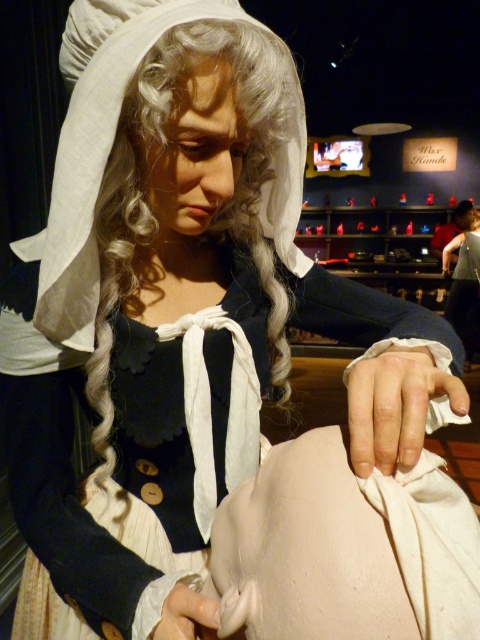
Question: Can you confirm if white silky hair at center is positioned to the left of matte white wig at upper left?

Choices:
 (A) yes
 (B) no

Answer: (A)

Question: Is white silky hair at center positioned behind matte white wig at upper left?

Choices:
 (A) yes
 (B) no

Answer: (B)

Question: Which object appears farthest from the camera in this image?

Choices:
 (A) white silky hair at center
 (B) matte white wig at upper left

Answer: (B)

Question: Is white silky hair at center closer to camera compared to matte white wig at upper left?

Choices:
 (A) yes
 (B) no

Answer: (A)